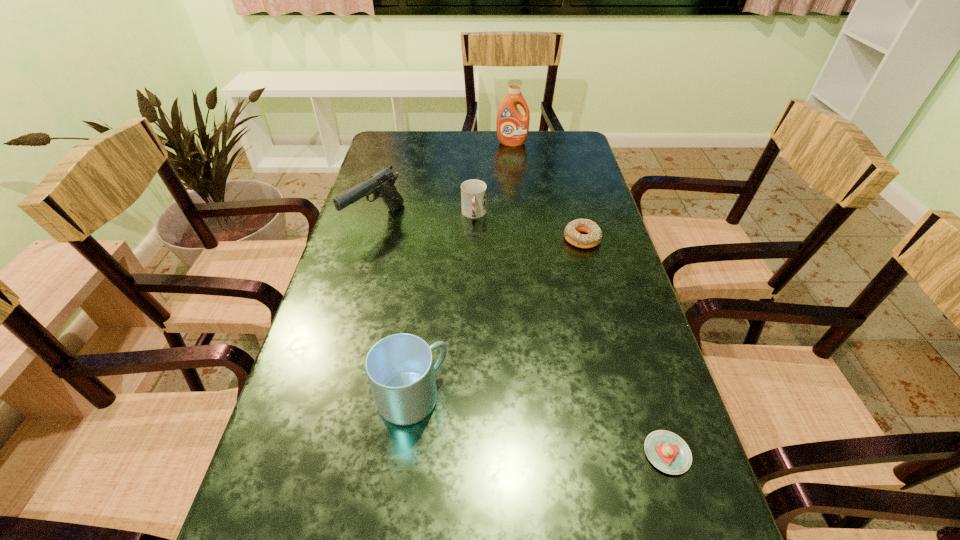
Image resolution: width=960 pixels, height=540 pixels. I want to click on detergent, so click(x=512, y=127).

Find the location of a particular element. the tallest object is located at coordinates (512, 127).

The image size is (960, 540). What are the coordinates of `gun` in the screenshot? It's located at (381, 184).

Locate an element on the screen. the fifth object from right to left is located at coordinates (400, 368).

The width and height of the screenshot is (960, 540). Find the location of `the fifth farthest object`. the fifth farthest object is located at coordinates (400, 368).

Locate an element on the screen. the fourth tallest object is located at coordinates (473, 192).

Identify the location of cup. (473, 192).

What are the coordinates of `the second shortest object` in the screenshot? It's located at (571, 233).

You are a GUI agent. You are given a task and a screenshot of the screen. Output one action in this format:
    pyautogui.click(x=<x>, y=<y>)
    Task: Click on the pastry
    
    Given the screenshot: What is the action you would take?
    pyautogui.click(x=668, y=452)

Locate an element on the screen. Image resolution: width=960 pixels, height=540 pixels. the nearest object is located at coordinates (668, 452).